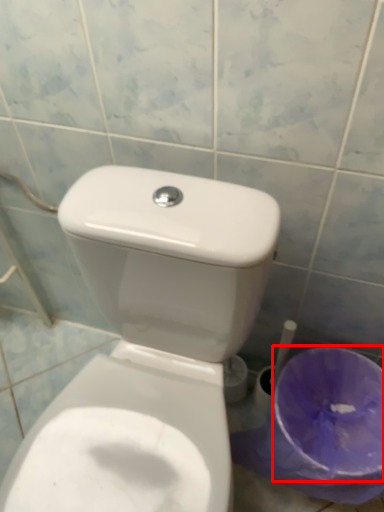
Question: Where is potty (annotated by the red box) located in relation to toilet in the image?

Choices:
 (A) left
 (B) right

Answer: (B)